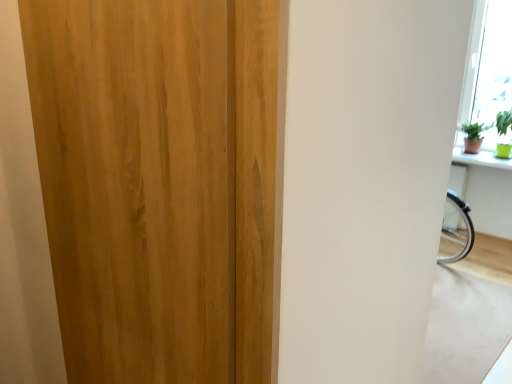
Question: From the image's perspective, would you say green matte window sill at upper right is positioned over wooden door at center?

Choices:
 (A) no
 (B) yes

Answer: (B)

Question: Can you confirm if green matte window sill at upper right is smaller than wooden door at center?

Choices:
 (A) no
 (B) yes

Answer: (B)

Question: Does green matte window sill at upper right touch wooden door at center?

Choices:
 (A) yes
 (B) no

Answer: (B)

Question: Is wooden door at center at the back of green matte window sill at upper right?

Choices:
 (A) no
 (B) yes

Answer: (A)

Question: From a real-world perspective, is green matte window sill at upper right beneath wooden door at center?

Choices:
 (A) yes
 (B) no

Answer: (A)

Question: Is the depth of green matte window sill at upper right greater than that of wooden door at center?

Choices:
 (A) yes
 (B) no

Answer: (A)

Question: From a real-world perspective, is wooden door at center below green matte window sill at upper right?

Choices:
 (A) no
 (B) yes

Answer: (A)

Question: Does wooden door at center have a greater height compared to green matte window sill at upper right?

Choices:
 (A) yes
 (B) no

Answer: (A)

Question: Is wooden door at center not inside green matte window sill at upper right?

Choices:
 (A) yes
 (B) no

Answer: (A)

Question: From the image's perspective, is wooden door at center over green matte window sill at upper right?

Choices:
 (A) no
 (B) yes

Answer: (A)

Question: Is green matte window sill at upper right completely or partially inside wooden door at center?

Choices:
 (A) yes
 (B) no

Answer: (B)

Question: Is wooden door at center facing away from green matte window sill at upper right?

Choices:
 (A) no
 (B) yes

Answer: (B)

Question: Choose the correct answer: Is green matte window sill at upper right inside wooden door at center or outside it?

Choices:
 (A) outside
 (B) inside

Answer: (A)